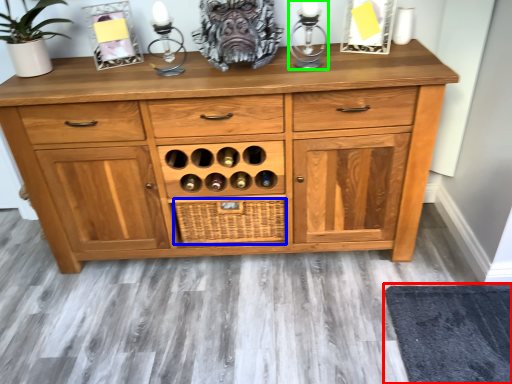
Question: Estimate the real-world distances between objects in this image. Which object is farther from mat (highlighted by a red box), crate (highlighted by a blue box) or candle holder (highlighted by a green box)?

Choices:
 (A) crate
 (B) candle holder

Answer: (B)